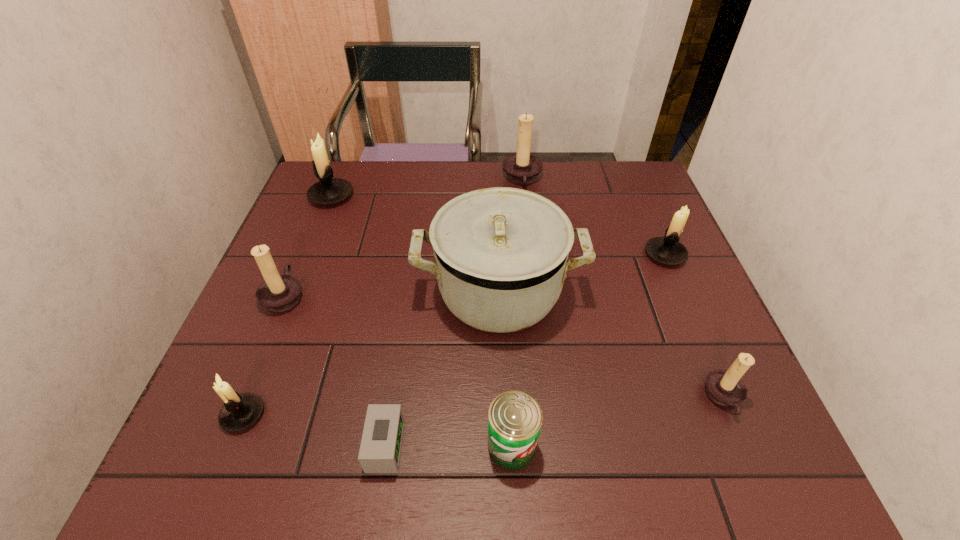
Where is `free point between the smallest white candle holder and the nearest brown candle holder`? The image size is (960, 540). free point between the smallest white candle holder and the nearest brown candle holder is located at coordinates (484, 406).

Where is `unoccupied position between the fourth candle holder from left to right and the rightmost brown candle holder`? Image resolution: width=960 pixels, height=540 pixels. unoccupied position between the fourth candle holder from left to right and the rightmost brown candle holder is located at coordinates (623, 288).

The width and height of the screenshot is (960, 540). I want to click on object that stands as the sixth closest to the leftmost brown candle holder, so click(x=522, y=168).

Where is `object that is the seventh closest to the second biggest brown candle holder`? Image resolution: width=960 pixels, height=540 pixels. object that is the seventh closest to the second biggest brown candle holder is located at coordinates (667, 250).

Locate an element on the screen. candle holder that is the third nearest to the farthest white candle holder is located at coordinates (240, 411).

In order to click on candle holder object that ranks as the third closest to the can in this screenshot , I will do `click(278, 293)`.

Select which brown candle holder is the closest to the farthest white candle holder. Please provide its 2D coordinates. Your answer should be formatted as a tuple, i.e. [(x, y)], where the tuple contains the x and y coordinates of a point satisfying the conditions above.

[(278, 293)]

The width and height of the screenshot is (960, 540). Identify the location of brown candle holder object that ranks as the second closest to the fourth nearest candle holder. (522, 168).

The width and height of the screenshot is (960, 540). What are the coordinates of `white candle holder that is the second closest to the white saucepan` in the screenshot? It's located at (328, 191).

Identify which white candle holder is located as the second nearest to the smallest white candle holder. Please provide its 2D coordinates. Your answer should be formatted as a tuple, i.e. [(x, y)], where the tuple contains the x and y coordinates of a point satisfying the conditions above.

[(667, 250)]